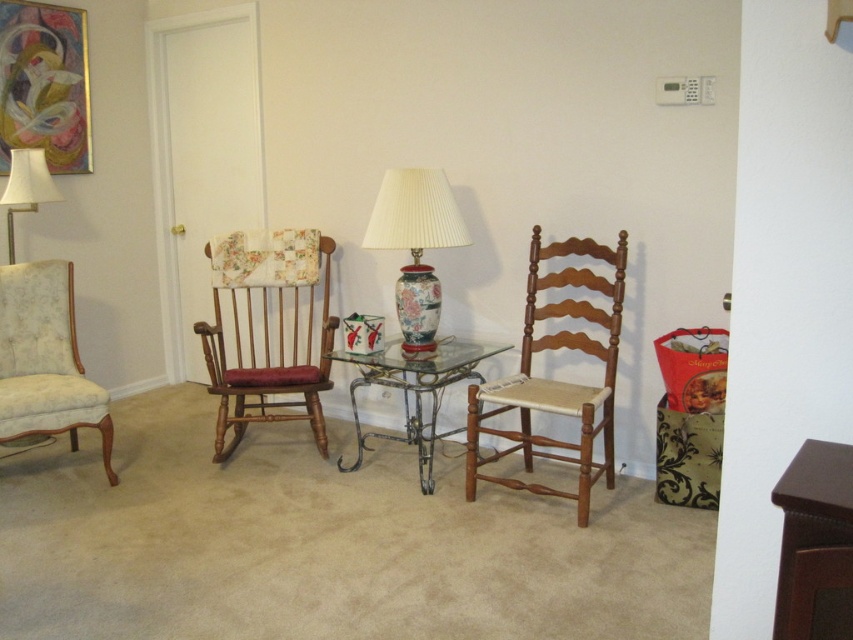
Can you confirm if wooden chair with woven seat at center is wider than porcelain floral lamp at center?

Yes, wooden chair with woven seat at center is wider than porcelain floral lamp at center.

Does wooden chair with woven seat at center have a greater height compared to porcelain floral lamp at center?

Indeed, wooden chair with woven seat at center has a greater height compared to porcelain floral lamp at center.

What do you see at coordinates (553, 380) in the screenshot?
I see `wooden chair with woven seat at center` at bounding box center [553, 380].

The width and height of the screenshot is (853, 640). I want to click on wooden chair with woven seat at center, so click(x=553, y=380).

Who is positioned more to the right, wooden textured rocking chair at left or metallic wrought iron table at center?

From the viewer's perspective, metallic wrought iron table at center appears more on the right side.

Does wooden textured rocking chair at left have a larger size compared to metallic wrought iron table at center?

Yes.

Where is `wooden textured rocking chair at left`? wooden textured rocking chair at left is located at coordinates (270, 358).

Who is higher up, wooden chair with woven seat at center or white fabric lampshade at upper left?

white fabric lampshade at upper left

Looking at this image, can you confirm if wooden chair with woven seat at center is positioned to the left of white fabric lampshade at upper left?

No, wooden chair with woven seat at center is not to the left of white fabric lampshade at upper left.

Between point (572, 400) and point (19, 152), which one is positioned behind?

The point (19, 152) is more distant.

The height and width of the screenshot is (640, 853). I want to click on wooden chair with woven seat at center, so click(553, 380).